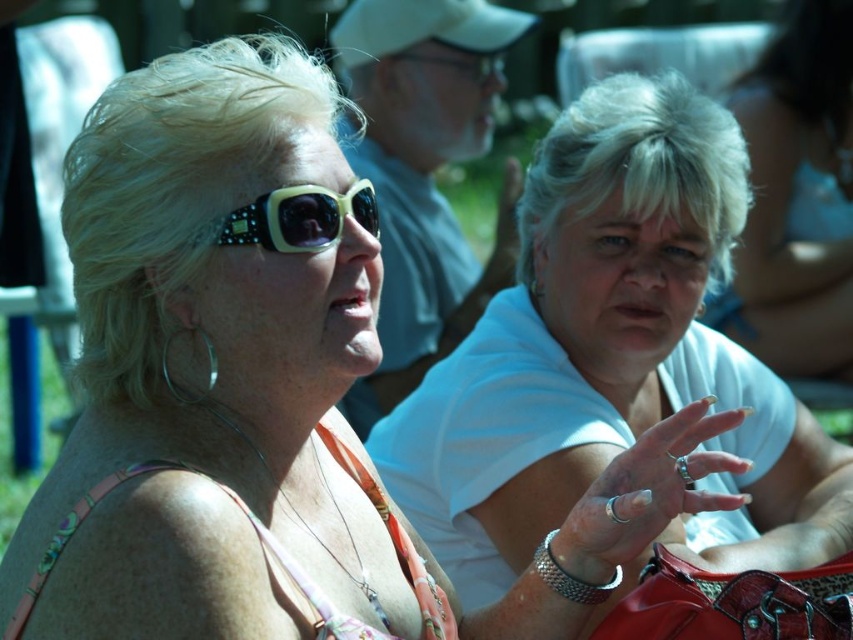
You are a photographer trying to capture a candid shot of the two women in the scene. You notice the white matte shirt at center and the matte black sunglasses at upper left. Which object should you focus on to ensure it appears larger in your photo?

The white matte shirt at center should be focused on because it is much taller than the matte black sunglasses at upper left, making it naturally larger in the frame.

You are a photographer trying to capture a candid shot of the two women in the scene. You want to ensure that both the white matte shirt at center and the matte black sunglasses at upper left are in focus. Given that your camera has a depth of field that can cover objects within a 36 inch range, will you be able to achieve this?

The white matte shirt at center and the matte black sunglasses at upper left are 36.86 inches apart. Since the distance between them is slightly more than the camera can handle, the photographer might need to adjust the focus or use a different setting to ensure both are in focus.

From the picture: You are a photographer at the event and want to capture a photo of both the white matte shirt at center and the matte black sunglasses at upper left. Which object should you focus on first to ensure both are in frame?

The white matte shirt at center is to the right of the matte black sunglasses at upper left, so you should focus on the matte black sunglasses at upper left first to ensure both are in frame.